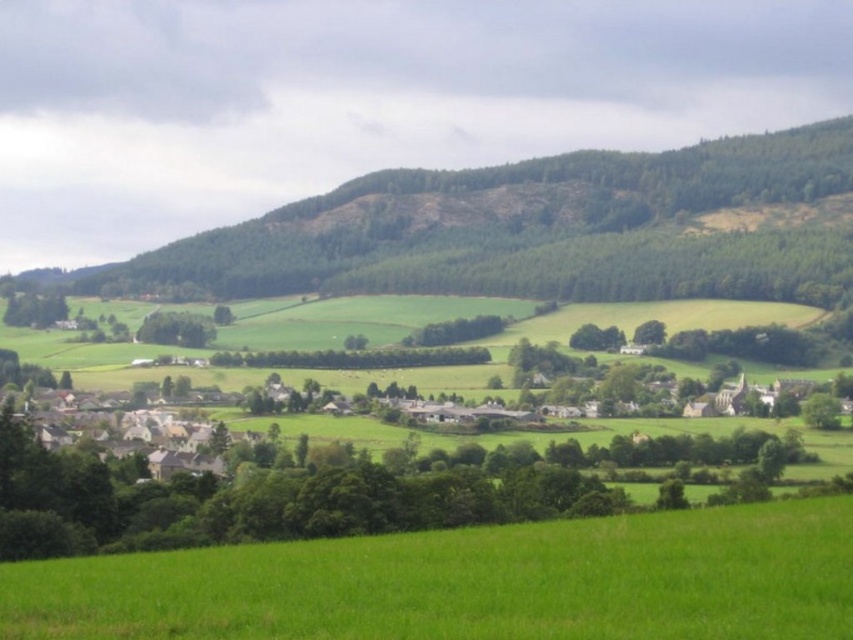
Question: Which object appears farthest from the camera in this image?

Choices:
 (A) green leafy tree at lower left
 (B) green grassy field at lower center
 (C) green leafy tree at center

Answer: (A)

Question: Is green grassy field at lower center smaller than green forested hill at upper center?

Choices:
 (A) no
 (B) yes

Answer: (B)

Question: Which of these objects is positioned farthest from the green grassy field at lower center?

Choices:
 (A) green leafy tree at lower left
 (B) green leafy tree at center
 (C) green forested hill at upper center

Answer: (A)

Question: Can you confirm if green grassy field at lower center is positioned above green forested hill at upper center?

Choices:
 (A) yes
 (B) no

Answer: (B)

Question: Is green forested hill at upper center to the left of green leafy tree at center from the viewer's perspective?

Choices:
 (A) yes
 (B) no

Answer: (B)

Question: Which of the following is the farthest from the observer?

Choices:
 (A) (50, 312)
 (B) (201, 342)
 (C) (173, 552)
 (D) (659, 170)

Answer: (A)